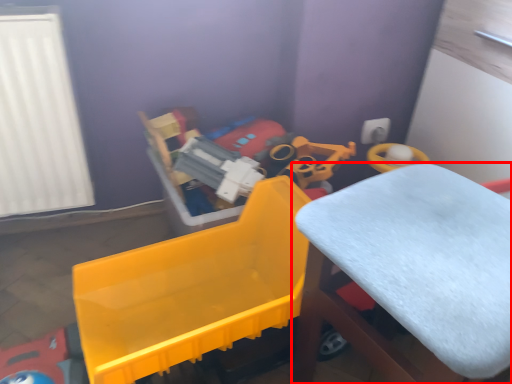
Question: Where is furniture (annotated by the red box) located in relation to toy in the image?

Choices:
 (A) right
 (B) left

Answer: (A)